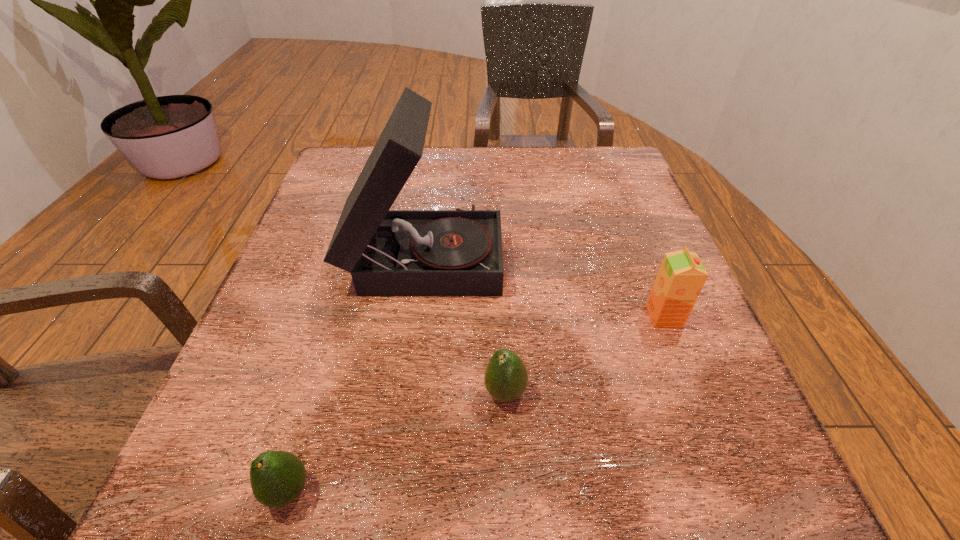
Where is `vacant space situated 0.120m on the back of the right avocado`? The image size is (960, 540). vacant space situated 0.120m on the back of the right avocado is located at coordinates (501, 315).

The width and height of the screenshot is (960, 540). Find the location of `vacant space located on the back of the nearest object`. vacant space located on the back of the nearest object is located at coordinates (354, 271).

The width and height of the screenshot is (960, 540). Identify the location of object present at the near edge. (277, 478).

The image size is (960, 540). What are the coordinates of `phonograph_record present at the left edge` in the screenshot? It's located at (458, 252).

Locate an element on the screen. Image resolution: width=960 pixels, height=540 pixels. avocado that is at the left edge is located at coordinates (277, 478).

Find the location of `object that is at the right edge`. object that is at the right edge is located at coordinates (681, 276).

Where is `object located at the near left corner`? The height and width of the screenshot is (540, 960). object located at the near left corner is located at coordinates (277, 478).

In order to click on vacant space at the far edge of the desktop in this screenshot , I will do `click(490, 154)`.

I want to click on blank space at the near edge of the desktop, so click(x=323, y=523).

At what (x,y) coordinates should I click in order to perform the action: click on free point at the left edge. Please return your answer as a coordinate pair (x, y). Looking at the image, I should click on (264, 420).